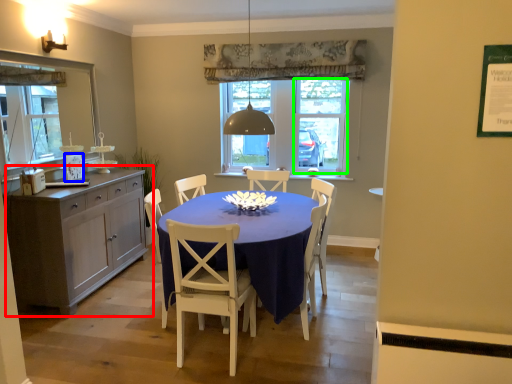
Question: Considering the real-world distances, which object is farthest from cabinetry (highlighted by a red box)? picture frame (highlighted by a blue box) or glass door (highlighted by a green box)?

Choices:
 (A) picture frame
 (B) glass door

Answer: (B)